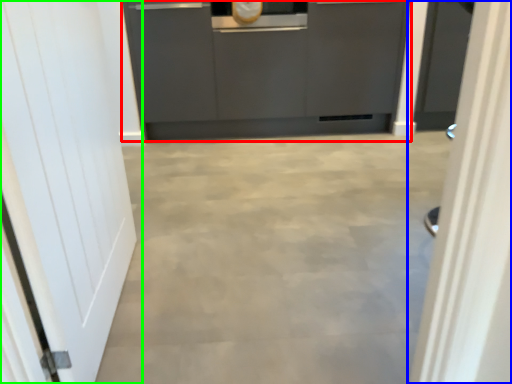
Question: Which object is the farthest from cabinetry (highlighted by a red box)? Choose among these: door (highlighted by a blue box) or door (highlighted by a green box).

Choices:
 (A) door
 (B) door

Answer: (A)